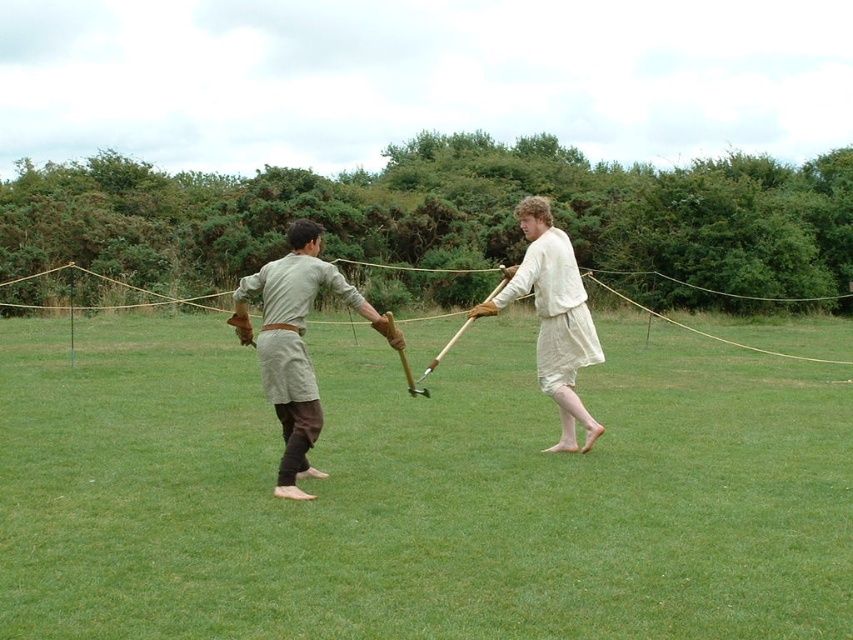
Question: Is light beige fabric shirt at center above light beige linen shorts at center?

Choices:
 (A) yes
 (B) no

Answer: (A)

Question: Among these objects, which one is nearest to the camera?

Choices:
 (A) green grass at center
 (B) light beige fabric sword at center
 (C) light beige fabric shirt at center
 (D) light beige linen shorts at center

Answer: (A)

Question: Which of the following is the closest to the observer?

Choices:
 (A) (286, 324)
 (B) (252, 356)
 (C) (285, 420)
 (D) (558, 321)

Answer: (A)

Question: Considering the real-world distances, which object is closest to the light beige linen shorts at center?

Choices:
 (A) light beige fabric shirt at center
 (B) light beige fabric sword at center

Answer: (B)

Question: Is light beige fabric sword at center closer to the viewer compared to light beige linen shorts at center?

Choices:
 (A) yes
 (B) no

Answer: (A)

Question: Does green grass at center have a smaller size compared to light beige fabric shirt at center?

Choices:
 (A) no
 (B) yes

Answer: (B)